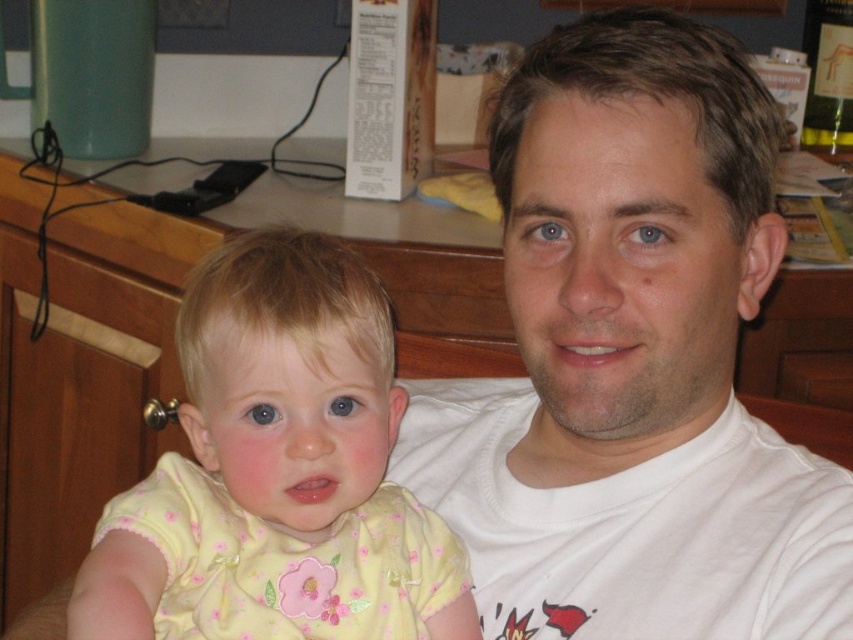
Between white cotton shirt at center and yellow fabric shirt at center, which one is positioned higher?

white cotton shirt at center is above.

Can you confirm if white cotton shirt at center is taller than yellow fabric shirt at center?

Yes.

Does point (608, 300) lie in front of point (360, 336)?

That is True.

Find the location of a particular element. The image size is (853, 640). white cotton shirt at center is located at coordinates (631, 362).